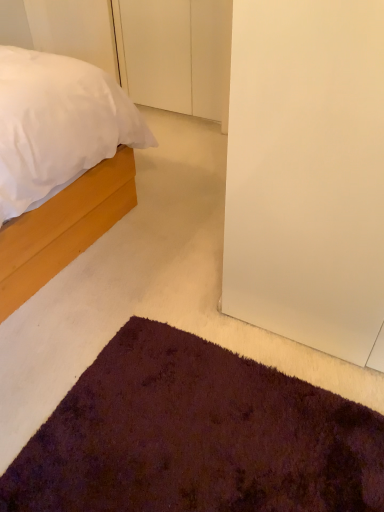
The image size is (384, 512). What are the coordinates of `white matte door at upper center` in the screenshot? It's located at (178, 55).

This screenshot has height=512, width=384. Describe the element at coordinates (178, 55) in the screenshot. I see `white matte door at upper center` at that location.

You are a GUI agent. You are given a task and a screenshot of the screen. Output one action in this format:
    pyautogui.click(x=<x>, y=<y>)
    Task: Click on the matte wood bed at left
    The image size is (384, 512).
    Given the screenshot: What is the action you would take?
    pyautogui.click(x=61, y=163)

What do you see at coordinates (61, 163) in the screenshot? I see `matte wood bed at left` at bounding box center [61, 163].

Where is `white matte door at upper center`? This screenshot has height=512, width=384. white matte door at upper center is located at coordinates (178, 55).

Between matte wood bed at left and white matte door at upper center, which one appears on the left side from the viewer's perspective?

matte wood bed at left.

Which is in front, matte wood bed at left or white matte door at upper center?

matte wood bed at left is closer to the camera.

Which is farther from the camera, [80,234] or [184,9]?

The point [184,9] is behind.

From the image's perspective, is matte wood bed at left on top of white matte door at upper center?

No.

From a real-world perspective, which is physically below, matte wood bed at left or white matte door at upper center?

From a 3D spatial view, white matte door at upper center is below.

Considering the sizes of objects matte wood bed at left and white matte door at upper center in the image provided, who is thinner, matte wood bed at left or white matte door at upper center?

white matte door at upper center.

Considering the relative sizes of matte wood bed at left and white matte door at upper center in the image provided, is matte wood bed at left shorter than white matte door at upper center?

No, matte wood bed at left is not shorter than white matte door at upper center.

Considering the relative sizes of matte wood bed at left and white matte door at upper center in the image provided, is matte wood bed at left smaller than white matte door at upper center?

No, matte wood bed at left is not smaller than white matte door at upper center.

Can we say matte wood bed at left lies outside white matte door at upper center?

Yes.

Is the surface of matte wood bed at left in direct contact with white matte door at upper center?

No, matte wood bed at left is not in contact with white matte door at upper center.

Based on the photo, is matte wood bed at left facing away from white matte door at upper center?

No, matte wood bed at left's orientation is not away from white matte door at upper center.

How different are the orientations of matte wood bed at left and white matte door at upper center in degrees?

90.2 degrees separate the facing orientations of matte wood bed at left and white matte door at upper center.

Measure the distance from matte wood bed at left to white matte door at upper center.

matte wood bed at left is 1.12 meters away from white matte door at upper center.

Find the location of `door above the matte wood bed at left (from the image's perspective)`. door above the matte wood bed at left (from the image's perspective) is located at coordinates (178, 55).

Consider the image. Which is more to the left, white matte door at upper center or matte wood bed at left?

Positioned to the left is matte wood bed at left.

Does white matte door at upper center come in front of matte wood bed at left?

No, white matte door at upper center is further to the viewer.

Is point (227, 27) in front of point (53, 239)?

No, (227, 27) is behind (53, 239).

From the image's perspective, is white matte door at upper center above or below matte wood bed at left?

Based on their image positions, white matte door at upper center is located above matte wood bed at left.

From a real-world perspective, does white matte door at upper center sit lower than matte wood bed at left?

Correct, in the physical world, white matte door at upper center is lower than matte wood bed at left.

Considering the relative sizes of white matte door at upper center and matte wood bed at left in the image provided, is white matte door at upper center thinner than matte wood bed at left?

Yes, white matte door at upper center is thinner than matte wood bed at left.

Considering the relative sizes of white matte door at upper center and matte wood bed at left in the image provided, is white matte door at upper center shorter than matte wood bed at left?

Indeed, white matte door at upper center has a lesser height compared to matte wood bed at left.

Considering the sizes of objects white matte door at upper center and matte wood bed at left in the image provided, who is bigger, white matte door at upper center or matte wood bed at left?

matte wood bed at left.

Is matte wood bed at left completely or partially inside white matte door at upper center?

Actually, matte wood bed at left is outside white matte door at upper center.

Is white matte door at upper center touching matte wood bed at left?

No, white matte door at upper center is not next to matte wood bed at left.

Does white matte door at upper center turn towards matte wood bed at left?

Yes, white matte door at upper center is facing matte wood bed at left.

How different are the orientations of white matte door at upper center and matte wood bed at left in degrees?

There is a 90.2-degree angle between the facing directions of white matte door at upper center and matte wood bed at left.

Where is `bed that is in front of the white matte door at upper center`? bed that is in front of the white matte door at upper center is located at coordinates click(61, 163).

This screenshot has width=384, height=512. In order to click on door behind the matte wood bed at left in this screenshot , I will do `click(178, 55)`.

Find the location of a particular element. bed lying in front of the white matte door at upper center is located at coordinates (61, 163).